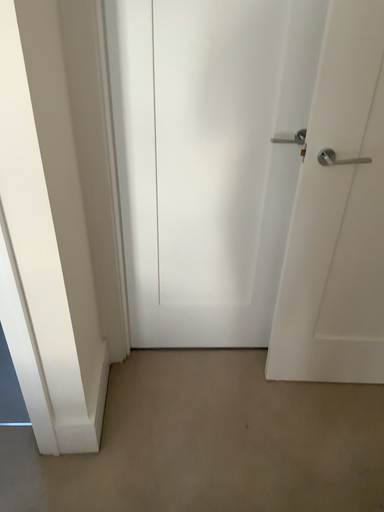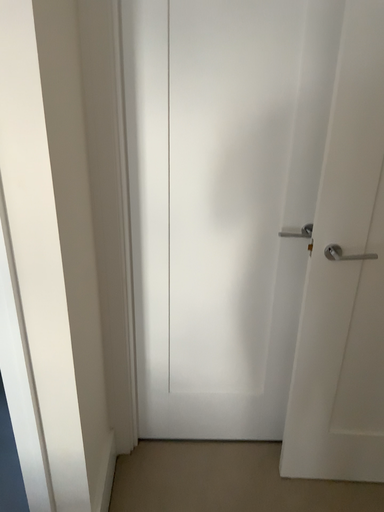
Question: Which way did the camera rotate in the video?

Choices:
 (A) rotated downward
 (B) rotated upward

Answer: (B)